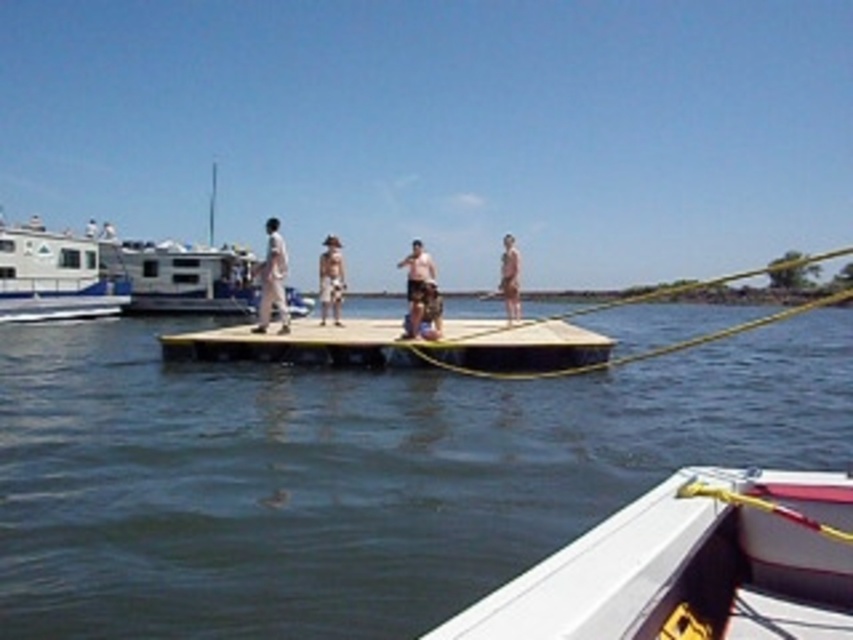
You are planning to place a beige fabric hat at center on the brown wooden dock at center. Considering their sizes, will the hat fit entirely on the dock?

The brown wooden dock at center is bigger than beige fabric hat at center, so yes, the hat will fit entirely on the dock.

You are standing at the edge of the dock and want to reach a floating object located at point (349, 339). If your maximum reach is 40 feet, can you grab it without moving?

The distance between you and the point (349, 339) is 45.67 feet, which exceeds your maximum reach of 40 feet. You cannot grab it without moving.